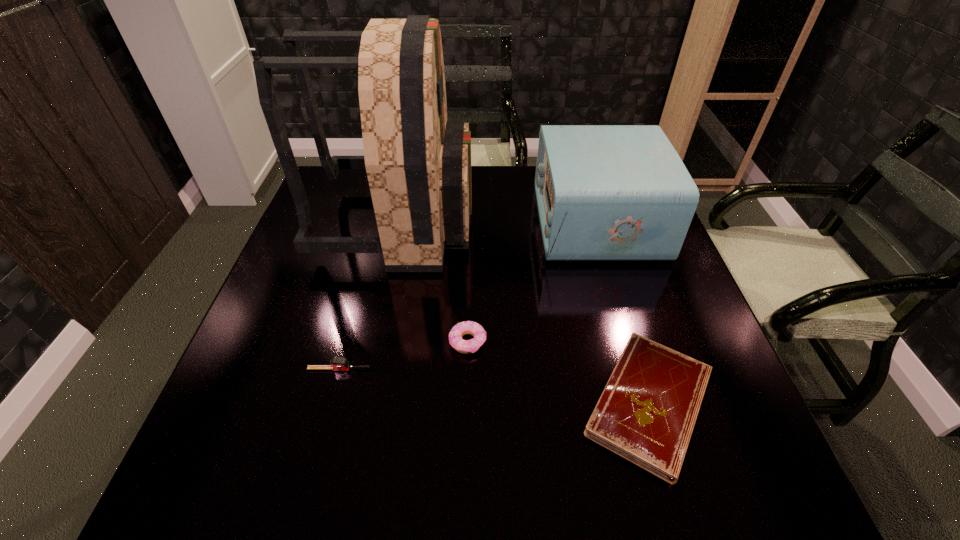
At what (x,y) coordinates should I click in order to perform the action: click on object located in the far right corner section of the desktop. Please return your answer as a coordinate pair (x, y). Image resolution: width=960 pixels, height=540 pixels. Looking at the image, I should click on (604, 192).

I want to click on object at the near right corner, so click(647, 412).

In the image, there is a desktop. Identify the location of vacant region at the far edge. (475, 195).

You are a GUI agent. You are given a task and a screenshot of the screen. Output one action in this format:
    pyautogui.click(x=<x>, y=<y>)
    Task: Click on the vacant space at the near edge of the desktop
    The width and height of the screenshot is (960, 540).
    Given the screenshot: What is the action you would take?
    pyautogui.click(x=509, y=498)

The image size is (960, 540). What are the coordinates of `blank space at the left edge of the desktop` in the screenshot? It's located at (287, 309).

The width and height of the screenshot is (960, 540). I want to click on vacant space at the right edge, so click(716, 403).

Where is `vacant point at the far left corner`? vacant point at the far left corner is located at coordinates (314, 194).

You are a GUI agent. You are given a task and a screenshot of the screen. Output one action in this format:
    pyautogui.click(x=<x>, y=<y>)
    Task: Click on the free spot at the near left corner of the desktop
    The image size is (960, 540).
    Given the screenshot: What is the action you would take?
    pyautogui.click(x=254, y=486)

Where is `vacant area that lies between the radio receiver and the shortest object`? This screenshot has width=960, height=540. vacant area that lies between the radio receiver and the shortest object is located at coordinates pyautogui.click(x=623, y=313).

Find the location of a particular element. This screenshot has width=960, height=540. vacant region between the tape measure and the radio receiver is located at coordinates (468, 295).